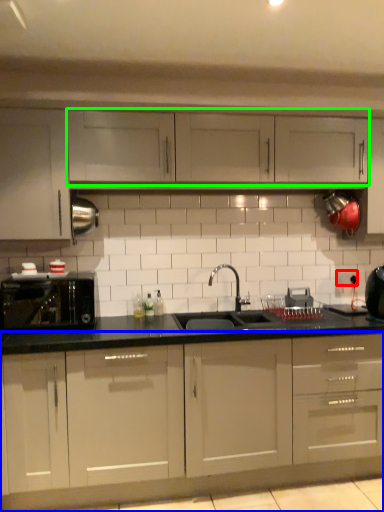
Question: Considering the real-world distances, which object is farthest from electric outlet (highlighted by a red box)? cabinetry (highlighted by a blue box) or cabinetry (highlighted by a green box)?

Choices:
 (A) cabinetry
 (B) cabinetry

Answer: (A)